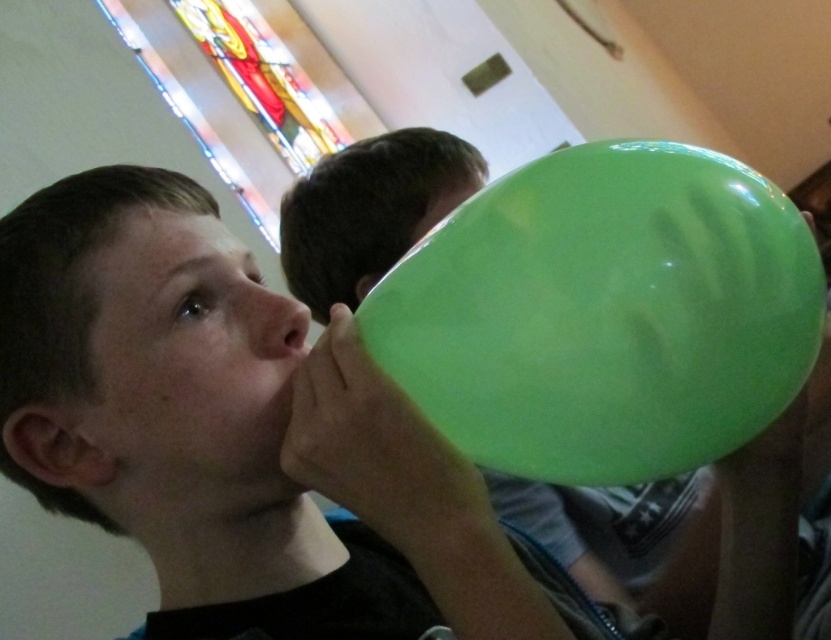
You are planning to hang both the matte green balloon at upper right and the green rubber balloon at center from the ceiling. Which balloon should you choose if you want the one that reaches closer to the floor?

The matte green balloon at upper right is taller than the green rubber balloon at center, so you should choose the matte green balloon at upper right to reach closer to the floor.

You are standing at the point with coordinates point (271, 356) and want to move to the point with coordinates point (539, 173). Is there a clear path between these two points without any obstacles?

Point (271, 356) is behind point (539, 173), so there might be an obstacle blocking the path between them. You may need to move around the point (539, 173) to reach your destination.